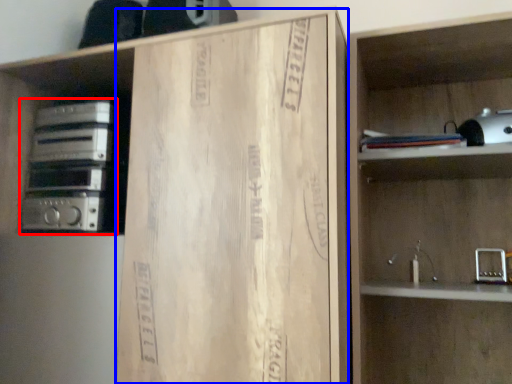
Question: Which object is further to the camera taking this photo, stereo (highlighted by a red box) or cardboard (highlighted by a blue box)?

Choices:
 (A) stereo
 (B) cardboard

Answer: (A)